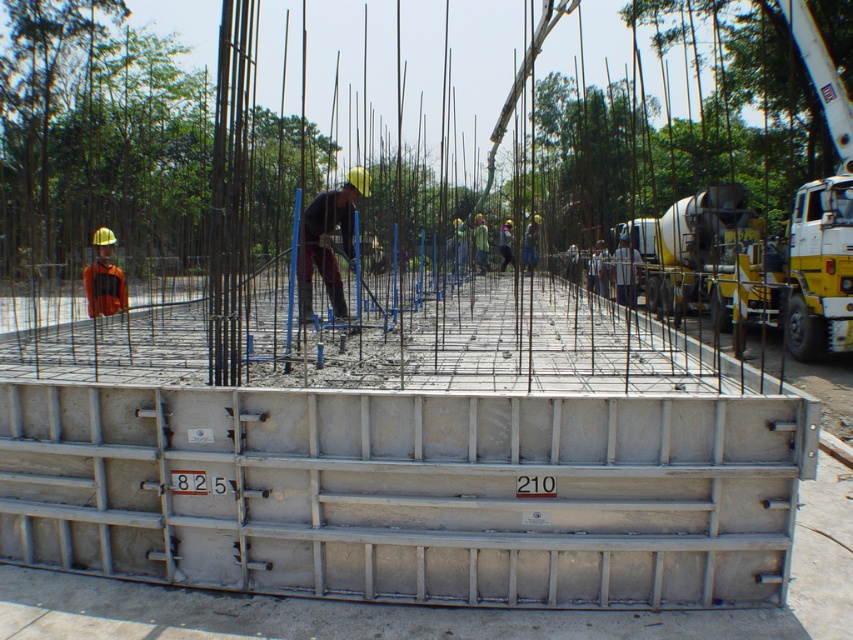
Question: Is matte black helmet at center behind orange reflective vest at left?

Choices:
 (A) no
 (B) yes

Answer: (A)

Question: Is silver metallic foundation at center smaller than matte black helmet at center?

Choices:
 (A) no
 (B) yes

Answer: (A)

Question: Is silver metallic foundation at center positioned at the back of matte black helmet at center?

Choices:
 (A) yes
 (B) no

Answer: (B)

Question: Among these objects, which one is nearest to the camera?

Choices:
 (A) matte black helmet at center
 (B) silver metallic foundation at center
 (C) orange reflective vest at left

Answer: (B)

Question: Among these objects, which one is farthest from the camera?

Choices:
 (A) silver metallic foundation at center
 (B) orange reflective vest at left
 (C) matte black helmet at center

Answer: (B)

Question: Which of the following is the farthest from the observer?

Choices:
 (A) orange reflective vest at left
 (B) silver metallic foundation at center
 (C) matte black helmet at center

Answer: (A)